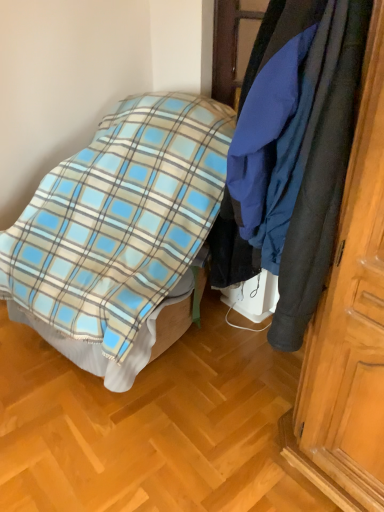
Question: Is plaid fabric bed at center facing towards dark blue fabric coat at right?

Choices:
 (A) no
 (B) yes

Answer: (A)

Question: Is plaid fabric bed at center wider than dark blue fabric coat at right?

Choices:
 (A) no
 (B) yes

Answer: (B)

Question: Does plaid fabric bed at center appear on the left side of dark blue fabric coat at right?

Choices:
 (A) yes
 (B) no

Answer: (A)

Question: Is dark blue fabric coat at right at the back of plaid fabric bed at center?

Choices:
 (A) yes
 (B) no

Answer: (B)

Question: Does plaid fabric bed at center touch dark blue fabric coat at right?

Choices:
 (A) yes
 (B) no

Answer: (B)

Question: From a real-world perspective, is plaid fabric bed at center over dark blue fabric coat at right?

Choices:
 (A) no
 (B) yes

Answer: (A)

Question: Would you say dark blue fabric coat at right is outside plaid fabric bed at center?

Choices:
 (A) yes
 (B) no

Answer: (A)

Question: Does dark blue fabric coat at right have a smaller size compared to plaid fabric bed at center?

Choices:
 (A) yes
 (B) no

Answer: (A)

Question: Is dark blue fabric coat at right next to plaid fabric bed at center and touching it?

Choices:
 (A) no
 (B) yes

Answer: (A)

Question: Does dark blue fabric coat at right have a greater height compared to plaid fabric bed at center?

Choices:
 (A) no
 (B) yes

Answer: (A)

Question: From the image's perspective, does dark blue fabric coat at right appear higher than plaid fabric bed at center?

Choices:
 (A) no
 (B) yes

Answer: (B)

Question: Could you tell me if dark blue fabric coat at right is turned towards plaid fabric bed at center?

Choices:
 (A) no
 (B) yes

Answer: (A)

Question: In terms of size, does dark blue fabric coat at right appear bigger or smaller than plaid fabric bed at center?

Choices:
 (A) small
 (B) big

Answer: (A)